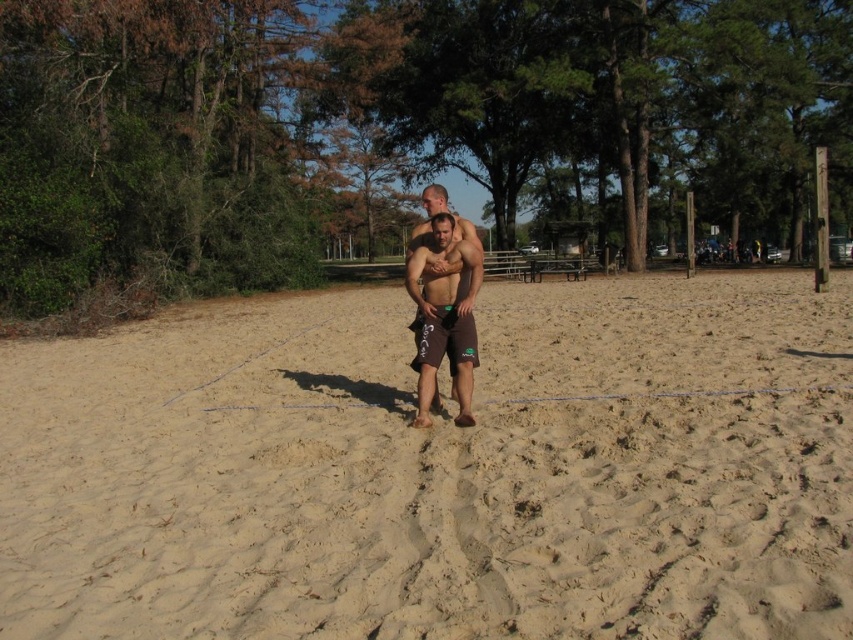
You are a photographer trying to capture a wide shot of the volleyball court. The beige sandy beach at center and the brown matte shorts at center are both in your frame. Which object is wider in the image?

The beige sandy beach at center is wider than the brown matte shorts at center.

Where is the beige sandy beach at center located in the image?

The beige sandy beach at center is located at point coordinates of (x=440, y=472).

You are a photographer positioned at the edge of the volleyball court. You want to capture a photo of the brown matte shorts at center without including the beige sandy beach at center in the background. Is this possible based on their positions?

The beige sandy beach at center is located below the brown matte shorts at center, so if you position your camera to focus on the shorts and avoid capturing the area below them, it should be possible to exclude the beige sandy beach at center from the photo.